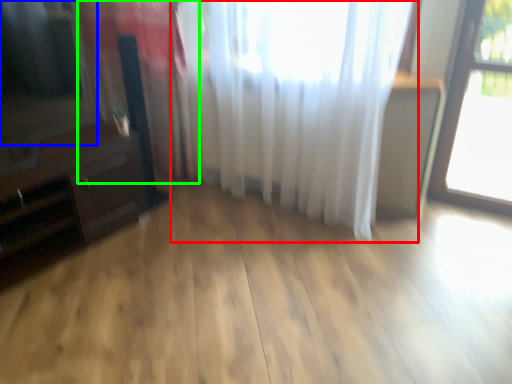
Question: Estimate the real-world distances between objects in this image. Which object is closer to curtain (highlighted by a red box), window screen (highlighted by a blue box) or curtain (highlighted by a green box)?

Choices:
 (A) window screen
 (B) curtain

Answer: (B)